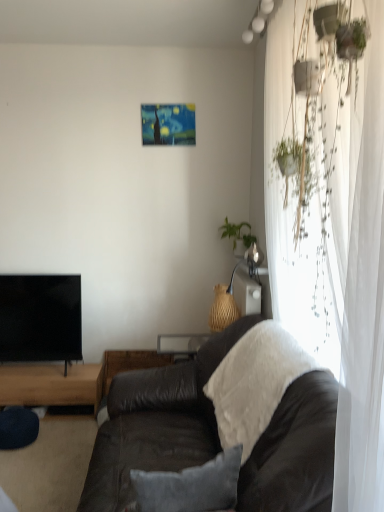
This screenshot has height=512, width=384. What do you see at coordinates (156, 423) in the screenshot? I see `leather couch at center` at bounding box center [156, 423].

The width and height of the screenshot is (384, 512). What do you see at coordinates (51, 385) in the screenshot? I see `brown wooden table at lower left, which appears as the first table when viewed from the left` at bounding box center [51, 385].

Image resolution: width=384 pixels, height=512 pixels. What do you see at coordinates (190, 486) in the screenshot?
I see `velvet gray pillow at center` at bounding box center [190, 486].

Locate an element on the screen. black glossy tv at left is located at coordinates (40, 318).

Measure the distance between point (285, 347) and camera.

Point (285, 347) is 6.38 feet from camera.

Locate an element on the screen. white fluffy blanket at center is located at coordinates (255, 383).

Describe the element at coordinates (333, 234) in the screenshot. I see `white sheer curtain at right` at that location.

The image size is (384, 512). What are the coordinates of `woven wood table at center, the second table in the left-to-right sequence` in the screenshot? It's located at (128, 364).

This screenshot has height=512, width=384. In order to click on green leafy plant at upper right in this screenshot , I will do `click(237, 233)`.

This screenshot has height=512, width=384. In order to click on leather couch at center in this screenshot , I will do `click(156, 423)`.

From the image's perspective, between brown wooden table at lower left, placed as the second table when sorted from right to left, and white fluffy blanket at center, who is located below?

brown wooden table at lower left, placed as the second table when sorted from right to left, appears lower in the image.

Does brown wooden table at lower left, placed as the second table when sorted from right to left, have a lesser height compared to white fluffy blanket at center?

Correct, brown wooden table at lower left, placed as the second table when sorted from right to left, is not as tall as white fluffy blanket at center.

Can you tell me how much brown wooden table at lower left, which appears as the first table when viewed from the left, and white fluffy blanket at center differ in facing direction?

The facing directions of brown wooden table at lower left, which appears as the first table when viewed from the left, and white fluffy blanket at center are 87.8 degrees apart.

Is brown wooden table at lower left, which appears as the first table when viewed from the left, located outside white fluffy blanket at center?

That's correct, brown wooden table at lower left, which appears as the first table when viewed from the left, is outside of white fluffy blanket at center.

Which of these two, leather couch at center or white sheer curtain at right, stands shorter?

leather couch at center.

From the image's perspective, is leather couch at center positioned above or below white sheer curtain at right?

Based on their image positions, leather couch at center is located beneath white sheer curtain at right.

Is leather couch at center bigger or smaller than white sheer curtain at right?

leather couch at center is bigger than white sheer curtain at right.

Would you consider white fluffy blanket at center to be distant from brown wooden table at lower left, which appears as the first table when viewed from the left?

Yes, white fluffy blanket at center and brown wooden table at lower left, which appears as the first table when viewed from the left, are quite far apart.

Measure the distance between white fluffy blanket at center and brown wooden table at lower left, which appears as the first table when viewed from the left.

The distance of white fluffy blanket at center from brown wooden table at lower left, which appears as the first table when viewed from the left, is 4.72 feet.

Relative to brown wooden table at lower left, placed as the second table when sorted from right to left, is white fluffy blanket at center in front or behind?

Visually, white fluffy blanket at center is located in front of brown wooden table at lower left, placed as the second table when sorted from right to left.

Can you confirm if white fluffy blanket at center is shorter than brown wooden table at lower left, placed as the second table when sorted from right to left?

Incorrect, the height of white fluffy blanket at center does not fall short of that of brown wooden table at lower left, placed as the second table when sorted from right to left.

From the image's perspective, does brown wooden table at lower left, placed as the second table when sorted from right to left, appear lower than leather couch at center?

Yes, from the image's perspective, brown wooden table at lower left, placed as the second table when sorted from right to left, is beneath leather couch at center.

From a real-world perspective, which object rests below the other?

brown wooden table at lower left, which appears as the first table when viewed from the left, is physically lower.

Is the depth of brown wooden table at lower left, placed as the second table when sorted from right to left, greater than that of leather couch at center?

That is True.

From the picture: Do you think brown wooden table at lower left, which appears as the first table when viewed from the left, is within leather couch at center, or outside of it?

brown wooden table at lower left, which appears as the first table when viewed from the left, is spatially situated outside leather couch at center.

Measure the distance from white sheer curtain at right to green leafy plant at upper right.

A distance of 1.19 meters exists between white sheer curtain at right and green leafy plant at upper right.

Is white sheer curtain at right far away from green leafy plant at upper right?

white sheer curtain at right is positioned a significant distance from green leafy plant at upper right.

Considering the sizes of objects white sheer curtain at right and green leafy plant at upper right in the image provided, who is wider, white sheer curtain at right or green leafy plant at upper right?

white sheer curtain at right.

I want to click on curtain that is below the green leafy plant at upper right (from the image's perspective), so click(333, 234).

Can you confirm if black glossy tv at left is shorter than green leafy plant at upper right?

Incorrect, the height of black glossy tv at left does not fall short of that of green leafy plant at upper right.

Is black glossy tv at left aimed at green leafy plant at upper right?

No, black glossy tv at left does not turn towards green leafy plant at upper right.

From a real-world perspective, between black glossy tv at left and green leafy plant at upper right, who is vertically higher?

green leafy plant at upper right.

Is black glossy tv at left smaller than green leafy plant at upper right?

Actually, black glossy tv at left might be larger than green leafy plant at upper right.

Is brown wooden table at lower left, placed as the second table when sorted from right to left, to the left or to the right of white sheer curtain at right in the image?

In the image, brown wooden table at lower left, placed as the second table when sorted from right to left, appears on the left side of white sheer curtain at right.

How different are the orientations of brown wooden table at lower left, placed as the second table when sorted from right to left, and white sheer curtain at right in degrees?

brown wooden table at lower left, placed as the second table when sorted from right to left, and white sheer curtain at right are facing 94.1 degrees away from each other.

Between brown wooden table at lower left, placed as the second table when sorted from right to left, and white sheer curtain at right, which one has larger size?

With larger size is white sheer curtain at right.

Based on the photo, is brown wooden table at lower left, placed as the second table when sorted from right to left, inside or outside of white sheer curtain at right?

brown wooden table at lower left, placed as the second table when sorted from right to left, is not enclosed by white sheer curtain at right.

Where is `blanket in front of the brown wooden table at lower left, which appears as the first table when viewed from the left`? The image size is (384, 512). blanket in front of the brown wooden table at lower left, which appears as the first table when viewed from the left is located at coordinates (255, 383).

The image size is (384, 512). Identify the location of curtain that appears on the right of leather couch at center. (333, 234).

Based on their spatial positions, is white fluffy blanket at center or leather couch at center further from brown wooden table at lower left, which appears as the first table when viewed from the left?

Based on the image, white fluffy blanket at center appears to be further to brown wooden table at lower left, which appears as the first table when viewed from the left.

Based on their spatial positions, is velvet gray pillow at center or white sheer curtain at right further from woven wood table at center, which is counted as the 1th table, starting from the right?

velvet gray pillow at center lies further to woven wood table at center, which is counted as the 1th table, starting from the right, than the other object.

From the image, which object appears to be nearer to white fluffy blanket at center, velvet gray pillow at center or leather couch at center?

leather couch at center is positioned closer to the anchor white fluffy blanket at center.

Looking at the image, which one is located closer to brown wooden table at lower left, which appears as the first table when viewed from the left, woven wood table at center, the second table in the left-to-right sequence, or green leafy plant at upper right?

woven wood table at center, the second table in the left-to-right sequence, is closer to brown wooden table at lower left, which appears as the first table when viewed from the left.

Looking at the image, which one is located further to green leafy plant at upper right, woven wood table at center, the second table in the left-to-right sequence, or velvet gray pillow at center?

velvet gray pillow at center is positioned further to the anchor green leafy plant at upper right.

When comparing their distances from white sheer curtain at right, does green leafy plant at upper right or brown wooden table at lower left, which appears as the first table when viewed from the left, seem closer?

The object closer to white sheer curtain at right is green leafy plant at upper right.

From the image, which object appears to be farther from black glossy tv at left, leather couch at center or velvet gray pillow at center?

velvet gray pillow at center lies further to black glossy tv at left than the other object.

When comparing their distances from leather couch at center, does green leafy plant at upper right or white fluffy blanket at center seem closer?

white fluffy blanket at center.

You are a GUI agent. You are given a task and a screenshot of the screen. Output one action in this format:
    pyautogui.click(x=<x>, y=<y>)
    Task: Click on the pillow between leather couch at center and green leafy plant at upper right in the front-back direction
    
    Given the screenshot: What is the action you would take?
    pyautogui.click(x=190, y=486)

Where is `pillow positioned between leather couch at center and woven wood table at center, which is counted as the 1th table, starting from the right, from near to far`? The width and height of the screenshot is (384, 512). pillow positioned between leather couch at center and woven wood table at center, which is counted as the 1th table, starting from the right, from near to far is located at coordinates (190, 486).

At what (x,y) coordinates should I click in order to perform the action: click on pillow between white sheer curtain at right and green leafy plant at upper right along the z-axis. Please return your answer as a coordinate pair (x, y). This screenshot has height=512, width=384. Looking at the image, I should click on click(x=190, y=486).

The image size is (384, 512). In order to click on television between leather couch at center and woven wood table at center, the second table in the left-to-right sequence, in the front-back direction in this screenshot , I will do `click(40, 318)`.